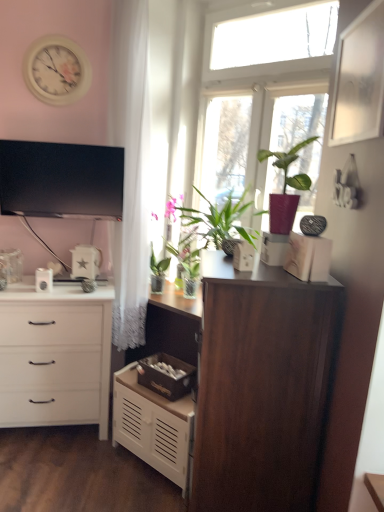
Where is `vacant space in front of white matte chest of drawers at left, acting as the 1th chest of drawers starting from the left`? The height and width of the screenshot is (512, 384). vacant space in front of white matte chest of drawers at left, acting as the 1th chest of drawers starting from the left is located at coordinates (50, 467).